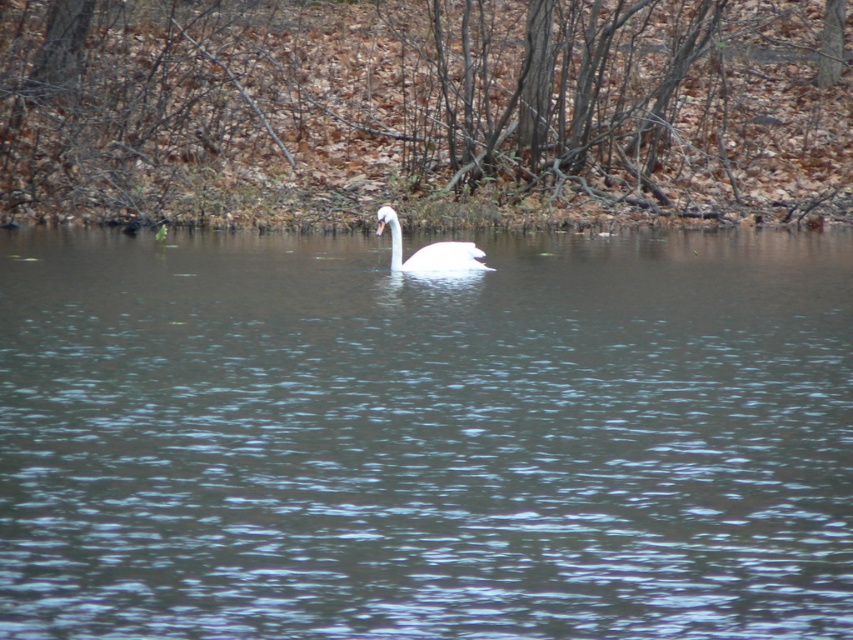
Question: Which point is closer to the camera?

Choices:
 (A) clear water at center
 (B) white glossy swan at center

Answer: (A)

Question: Does clear water at center lie in front of white glossy swan at center?

Choices:
 (A) no
 (B) yes

Answer: (B)

Question: In this image, where is clear water at center located relative to white glossy swan at center?

Choices:
 (A) below
 (B) above

Answer: (A)

Question: Is clear water at center positioned in front of white glossy swan at center?

Choices:
 (A) no
 (B) yes

Answer: (B)